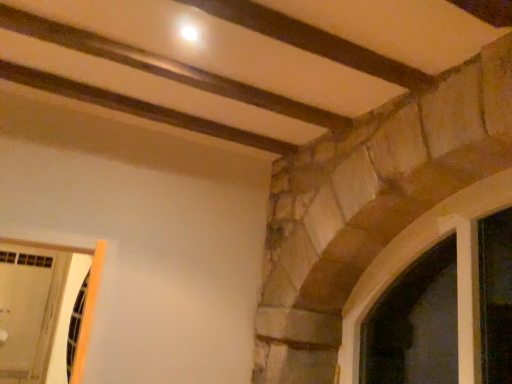
This screenshot has height=384, width=512. Describe the element at coordinates (415, 254) in the screenshot. I see `brown stone arch at upper right` at that location.

Measure the distance between brown stone arch at upper right and camera.

5.17 feet.

At what (x,y) coordinates should I click in order to perform the action: click on brown stone arch at upper right. Please return your answer as a coordinate pair (x, y). The height and width of the screenshot is (384, 512). Looking at the image, I should click on (415, 254).

At what (x,y) coordinates should I click in order to perform the action: click on brown stone arch at upper right. Please return your answer as a coordinate pair (x, y). Looking at the image, I should click on [415, 254].